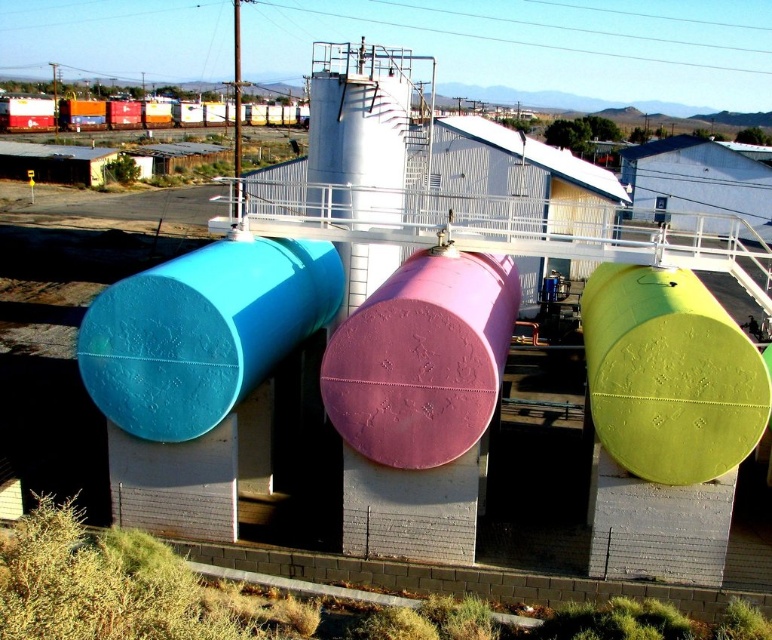
Which is behind, point (239, 384) or point (726, 426)?

Point (239, 384)

Can you confirm if matte blue barrel at center left is wider than green matte tank at center?

Yes, matte blue barrel at center left is wider than green matte tank at center.

Between point (96, 348) and point (686, 452), which one is positioned behind?

The point (96, 348) is behind.

The height and width of the screenshot is (640, 772). I want to click on matte blue barrel at center left, so click(x=202, y=332).

Which is behind, point (144, 394) or point (459, 269)?

The point (459, 269) is behind.

Can you confirm if matte blue barrel at center left is positioned below pink matte tank at center?

Indeed, matte blue barrel at center left is positioned under pink matte tank at center.

Image resolution: width=772 pixels, height=640 pixels. I want to click on matte blue barrel at center left, so click(x=202, y=332).

Does green matte tank at center appear over pink matte tank at center?

Yes.

Which is above, green matte tank at center or pink matte tank at center?

green matte tank at center is above.

Where is `green matte tank at center`? green matte tank at center is located at coordinates tap(669, 374).